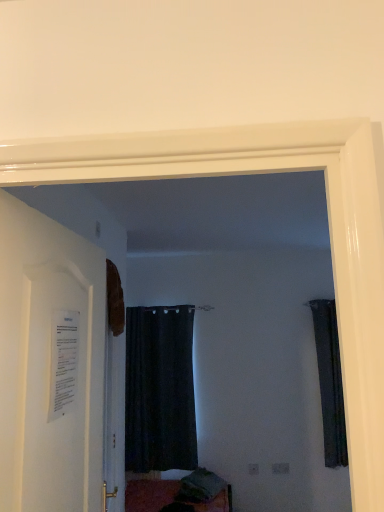
Question: From the image's perspective, does black matte curtain at center, the second curtain from the right, appear higher than dark fabric curtain at right, which is counted as the 1th curtain, starting from the right?

Choices:
 (A) no
 (B) yes

Answer: (A)

Question: Is the depth of black matte curtain at center, which ranks as the 1th curtain in left-to-right order, less than that of dark fabric curtain at right, which is the 2th curtain in left-to-right order?

Choices:
 (A) no
 (B) yes

Answer: (A)

Question: Is black matte curtain at center, the second curtain from the right, smaller than dark fabric curtain at right, which is counted as the 1th curtain, starting from the right?

Choices:
 (A) no
 (B) yes

Answer: (A)

Question: From a real-world perspective, does black matte curtain at center, which ranks as the 1th curtain in left-to-right order, sit lower than dark fabric curtain at right, which is the 2th curtain in left-to-right order?

Choices:
 (A) yes
 (B) no

Answer: (A)

Question: Considering the relative sizes of black matte curtain at center, the second curtain from the right, and dark fabric curtain at right, which is the 2th curtain in left-to-right order, in the image provided, is black matte curtain at center, the second curtain from the right, bigger than dark fabric curtain at right, which is the 2th curtain in left-to-right order,?

Choices:
 (A) no
 (B) yes

Answer: (B)

Question: Is black matte curtain at center, which ranks as the 1th curtain in left-to-right order, wider or thinner than white paper at left?

Choices:
 (A) thin
 (B) wide

Answer: (B)

Question: From the image's perspective, is black matte curtain at center, which ranks as the 1th curtain in left-to-right order, positioned above or below white paper at left?

Choices:
 (A) above
 (B) below

Answer: (B)

Question: From a real-world perspective, is black matte curtain at center, the second curtain from the right, positioned above or below white paper at left?

Choices:
 (A) below
 (B) above

Answer: (A)

Question: In the image, is black matte curtain at center, the second curtain from the right, on the left side or the right side of white paper at left?

Choices:
 (A) left
 (B) right

Answer: (B)

Question: Considering their positions, is black matte curtain at center, which ranks as the 1th curtain in left-to-right order, located in front of or behind dark fabric curtain at right, which is the 2th curtain in left-to-right order?

Choices:
 (A) behind
 (B) front

Answer: (A)

Question: Based on their sizes in the image, would you say black matte curtain at center, which ranks as the 1th curtain in left-to-right order, is bigger or smaller than dark fabric curtain at right, which is counted as the 1th curtain, starting from the right?

Choices:
 (A) small
 (B) big

Answer: (B)

Question: Visually, is black matte curtain at center, the second curtain from the right, positioned to the left or to the right of dark fabric curtain at right, which is counted as the 1th curtain, starting from the right?

Choices:
 (A) right
 (B) left

Answer: (B)

Question: Is black matte curtain at center, the second curtain from the right, wider or thinner than dark fabric curtain at right, which is counted as the 1th curtain, starting from the right?

Choices:
 (A) wide
 (B) thin

Answer: (A)

Question: Looking at the image, does dark fabric curtain at right, which is the 2th curtain in left-to-right order, seem bigger or smaller compared to white paper at left?

Choices:
 (A) small
 (B) big

Answer: (A)

Question: Relative to white paper at left, is dark fabric curtain at right, which is counted as the 1th curtain, starting from the right, in front or behind?

Choices:
 (A) behind
 (B) front

Answer: (A)